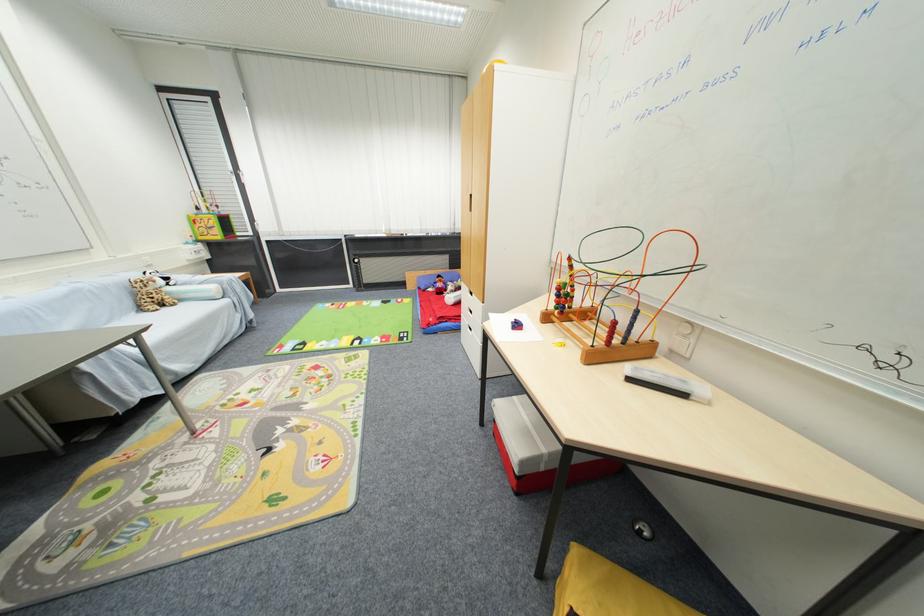
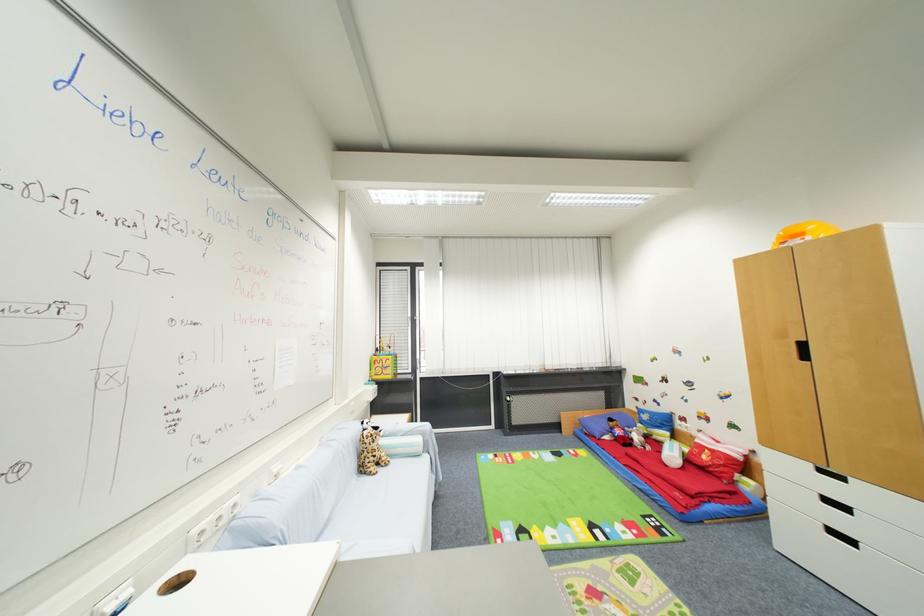
Locate, in the second image, the point that corresponds to point 146,310 in the first image.

(367, 472)